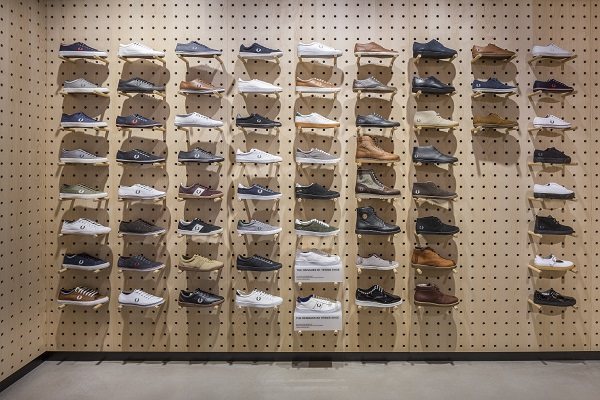
The width and height of the screenshot is (600, 400). I want to click on bottom row of shoes, so click(70, 301), click(142, 296), click(193, 300), click(253, 301), click(309, 312), click(372, 300), click(427, 299), click(546, 302).